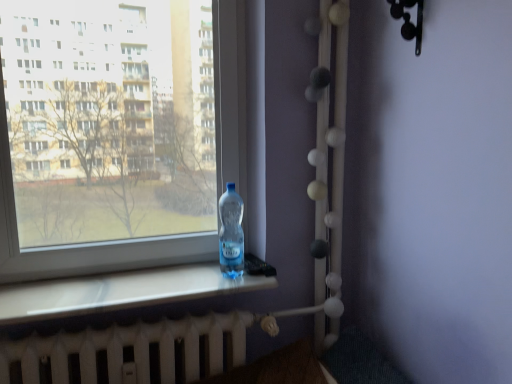
Question: From a real-world perspective, is transparent plastic bottle at window below transparent plastic bottle at left?

Choices:
 (A) no
 (B) yes

Answer: (B)

Question: From a real-world perspective, does transparent plastic bottle at window stand above transparent plastic bottle at left?

Choices:
 (A) no
 (B) yes

Answer: (A)

Question: Can you confirm if transparent plastic bottle at window is taller than transparent plastic bottle at left?

Choices:
 (A) yes
 (B) no

Answer: (B)

Question: Does transparent plastic bottle at window have a larger size compared to transparent plastic bottle at left?

Choices:
 (A) no
 (B) yes

Answer: (A)

Question: Is transparent plastic bottle at window far away from transparent plastic bottle at left?

Choices:
 (A) no
 (B) yes

Answer: (A)

Question: Is transparent plastic bottle at window looking in the opposite direction of transparent plastic bottle at left?

Choices:
 (A) no
 (B) yes

Answer: (B)

Question: Is transparent plastic bottle at window bigger than white matte radiator at bottom?

Choices:
 (A) yes
 (B) no

Answer: (B)

Question: Would you say transparent plastic bottle at window is outside white matte radiator at bottom?

Choices:
 (A) no
 (B) yes

Answer: (B)

Question: Considering the relative sizes of transparent plastic bottle at window and white matte radiator at bottom in the image provided, is transparent plastic bottle at window wider than white matte radiator at bottom?

Choices:
 (A) no
 (B) yes

Answer: (A)

Question: Does transparent plastic bottle at window have a lesser width compared to white matte radiator at bottom?

Choices:
 (A) no
 (B) yes

Answer: (B)

Question: From a real-world perspective, is transparent plastic bottle at window positioned over white matte radiator at bottom based on gravity?

Choices:
 (A) yes
 (B) no

Answer: (A)

Question: Does transparent plastic bottle at window come behind white matte radiator at bottom?

Choices:
 (A) no
 (B) yes

Answer: (B)

Question: Considering the relative sizes of transparent plastic bottle at left and white matte radiator at bottom in the image provided, is transparent plastic bottle at left thinner than white matte radiator at bottom?

Choices:
 (A) no
 (B) yes

Answer: (B)